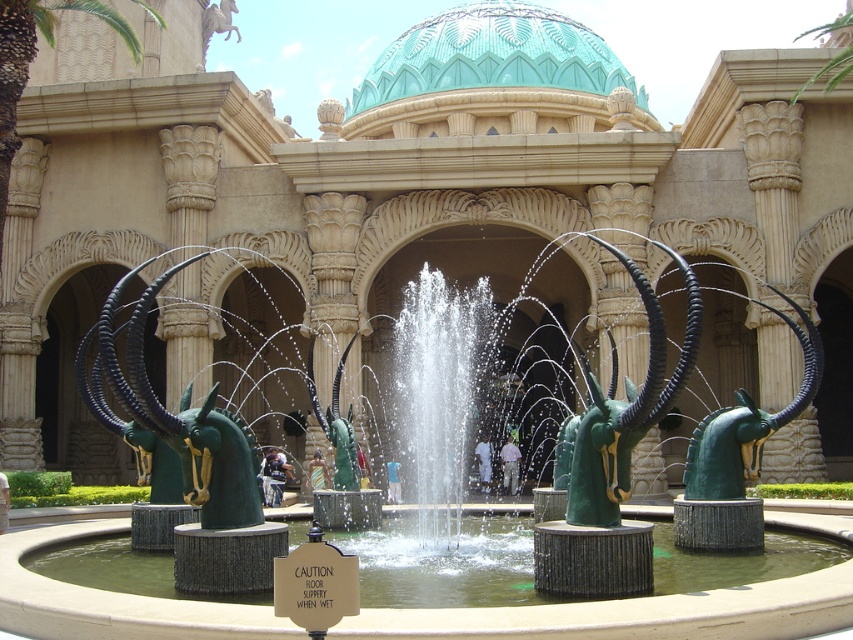
Question: Which of these objects is positioned closest to the light brown fabric umbrella at center?

Choices:
 (A) dark blue jeans at center
 (B) green leafy palm tree at upper left
 (C) white matte person at center

Answer: (C)

Question: Is green polished stone fountain at center further to camera compared to green matte sculpture at center?

Choices:
 (A) no
 (B) yes

Answer: (A)

Question: Which of the following is the closest to the observer?

Choices:
 (A) (13, 36)
 (B) (399, 486)

Answer: (A)

Question: Is green matte sculpture at center to the left of dark blue jeans at center from the viewer's perspective?

Choices:
 (A) no
 (B) yes

Answer: (B)

Question: Which of the following is the closest to the observer?

Choices:
 (A) (392, 499)
 (B) (579, 460)

Answer: (B)

Question: Is green polished stone antelope head at center thinner than white matte person at center?

Choices:
 (A) no
 (B) yes

Answer: (A)